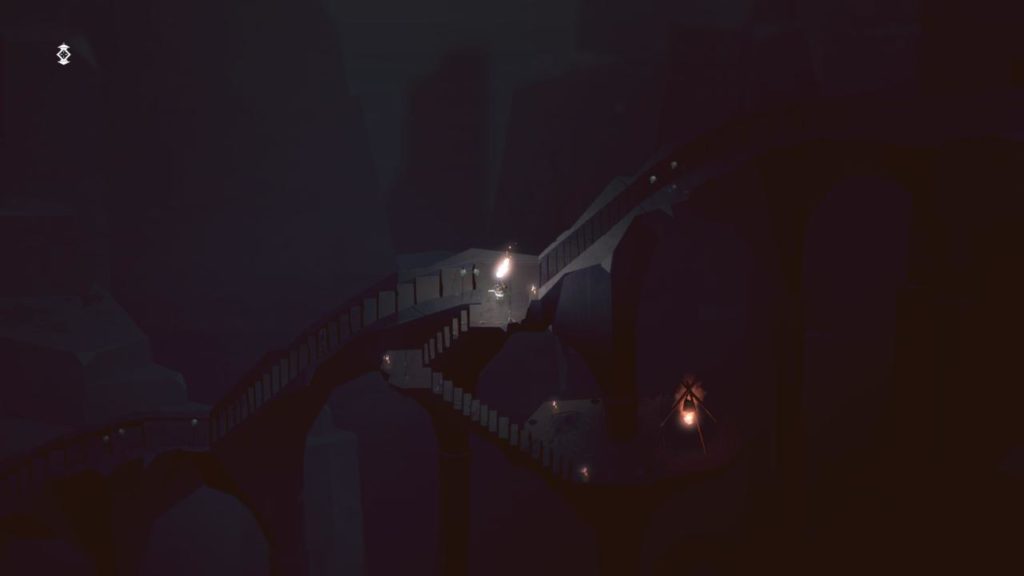
Where is `light`? The image size is (1024, 576). light is located at coordinates (687, 420).